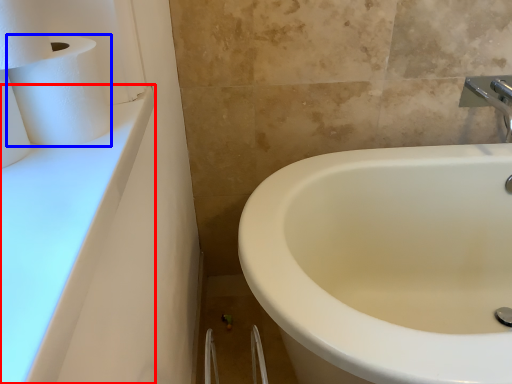
Question: Which of the following is the farthest to the observer, counter top (highlighted by a red box) or paper towel (highlighted by a blue box)?

Choices:
 (A) counter top
 (B) paper towel

Answer: (B)